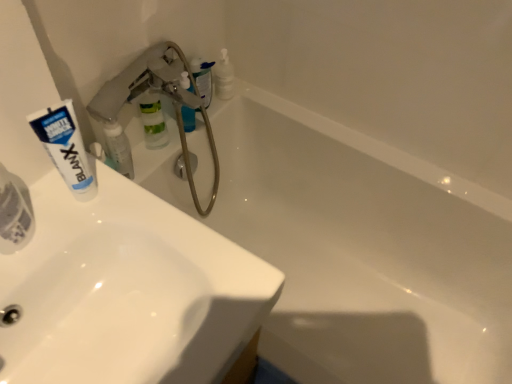
Question: From a real-world perspective, is translucent plastic bottle at upper center, which is counted as the 1th toiletry, starting from the back, on white matte tube at upper left?

Choices:
 (A) no
 (B) yes

Answer: (A)

Question: Can you confirm if translucent plastic bottle at upper center, placed as the 4th toiletry when sorted from front to back, is thinner than white matte tube at upper left?

Choices:
 (A) no
 (B) yes

Answer: (A)

Question: From the image's perspective, is translucent plastic bottle at upper center, placed as the 4th toiletry when sorted from front to back, beneath white matte tube at upper left?

Choices:
 (A) no
 (B) yes

Answer: (A)

Question: Considering the relative sizes of translucent plastic bottle at upper center, which is counted as the 1th toiletry, starting from the back, and white matte tube at upper left in the image provided, is translucent plastic bottle at upper center, which is counted as the 1th toiletry, starting from the back, taller than white matte tube at upper left?

Choices:
 (A) yes
 (B) no

Answer: (B)

Question: Is translucent plastic bottle at upper center, placed as the 4th toiletry when sorted from front to back, turned away from white matte tube at upper left?

Choices:
 (A) no
 (B) yes

Answer: (A)

Question: In terms of size, does white glossy bathtub at upper center appear bigger or smaller than translucent plastic toothpaste tube at left, placed as the fourth toiletry when sorted from back to front?

Choices:
 (A) big
 (B) small

Answer: (A)

Question: From the image's perspective, is white glossy bathtub at upper center above or below translucent plastic toothpaste tube at left, placed as the fourth toiletry when sorted from back to front?

Choices:
 (A) above
 (B) below

Answer: (B)

Question: Is white glossy bathtub at upper center wider or thinner than translucent plastic toothpaste tube at left, placed as the fourth toiletry when sorted from back to front?

Choices:
 (A) wide
 (B) thin

Answer: (A)

Question: From a real-world perspective, is white glossy bathtub at upper center positioned above or below translucent plastic toothpaste tube at left, placed as the fourth toiletry when sorted from back to front?

Choices:
 (A) below
 (B) above

Answer: (A)

Question: From a real-world perspective, is white glossy toothpaste tube at upper left, placed as the 2th toiletry when sorted from front to back, positioned above or below white glossy bathtub at upper center?

Choices:
 (A) above
 (B) below

Answer: (A)

Question: From their relative heights in the image, would you say white glossy toothpaste tube at upper left, acting as the third toiletry starting from the back, is taller or shorter than white glossy bathtub at upper center?

Choices:
 (A) short
 (B) tall

Answer: (A)

Question: Does point (126, 173) appear closer or farther from the camera than point (428, 299)?

Choices:
 (A) closer
 (B) farther

Answer: (A)

Question: From the image's perspective, is white glossy toothpaste tube at upper left, placed as the 2th toiletry when sorted from front to back, located above or below white glossy bathtub at upper center?

Choices:
 (A) below
 (B) above

Answer: (B)

Question: From the image's perspective, relative to white glossy sink at upper left, positioned as the second sink in front-to-back order, is white glossy sink at upper left, the 2th sink positioned from the back, above or below?

Choices:
 (A) below
 (B) above

Answer: (B)

Question: From a real-world perspective, is white glossy sink at upper left, the 2th sink positioned from the back, physically located above or below white glossy sink at upper left, acting as the first sink starting from the back?

Choices:
 (A) above
 (B) below

Answer: (A)